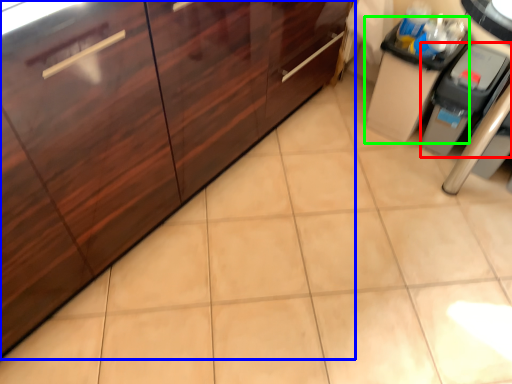
Question: Which object is positioned farthest from appliance (highlighted by a red box)? Select from cabinetry (highlighted by a blue box) and cabinetry (highlighted by a green box).

Choices:
 (A) cabinetry
 (B) cabinetry

Answer: (A)